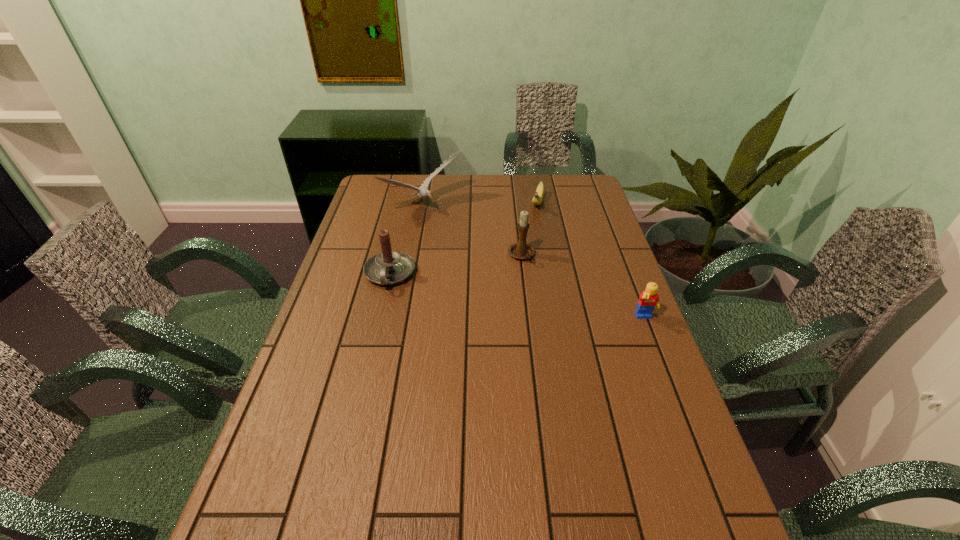
You are a GUI agent. You are given a task and a screenshot of the screen. Output one action in this format:
    pyautogui.click(x=<x>, y=<y>)
    Task: Click on the candle
    
    Given the screenshot: What is the action you would take?
    pyautogui.click(x=389, y=267)

Locate an element on the screen. The height and width of the screenshot is (540, 960). the nearest object is located at coordinates (648, 300).

The height and width of the screenshot is (540, 960). Find the location of `the rightmost object`. the rightmost object is located at coordinates (648, 300).

The height and width of the screenshot is (540, 960). In order to click on gull in this screenshot , I will do `click(423, 191)`.

The height and width of the screenshot is (540, 960). Find the location of `candle holder`. candle holder is located at coordinates click(x=521, y=250).

Identify the location of the second object from right to left. (537, 199).

This screenshot has width=960, height=540. I want to click on the shortest object, so click(537, 199).

You are a GUI agent. You are given a task and a screenshot of the screen. Output one action in this format:
    pyautogui.click(x=<x>, y=<y>)
    Task: Click on the vacant region located 0.140m on the side of the candle with the handle loop
    
    Given the screenshot: What is the action you would take?
    pyautogui.click(x=376, y=328)

At what (x,y) coordinates should I click in order to perform the action: click on vacant space situated on the face of the fourth tallest object. Please return your answer as a coordinate pair (x, y). The width and height of the screenshot is (960, 540). Looking at the image, I should click on (664, 368).

Where is `vacant region located 0.370m at the tip of the beak of the gull`? Image resolution: width=960 pixels, height=540 pixels. vacant region located 0.370m at the tip of the beak of the gull is located at coordinates (509, 274).